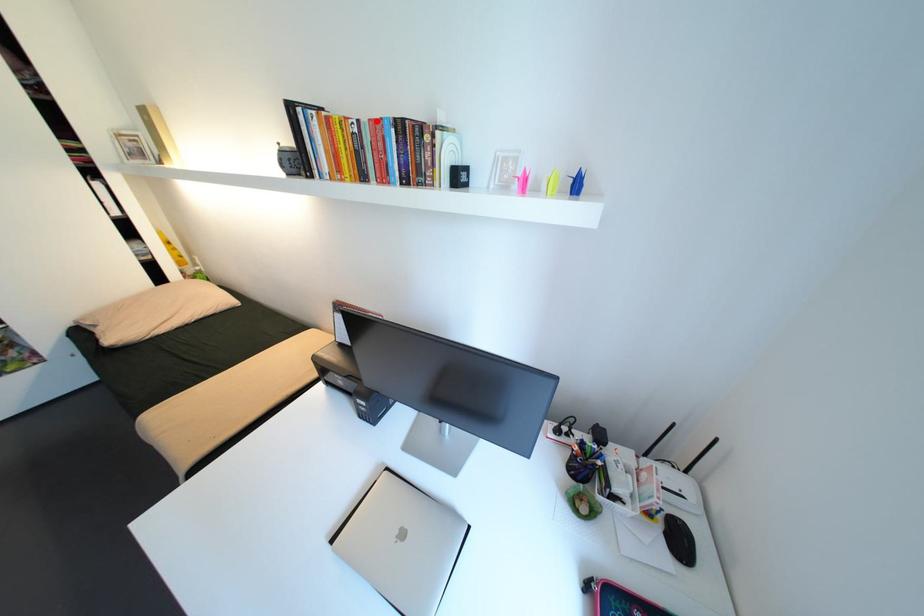
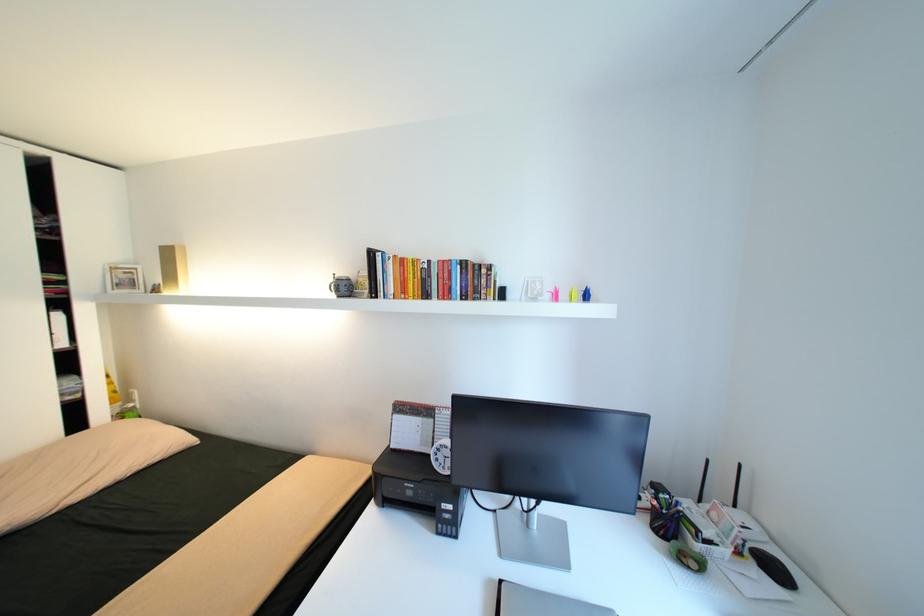
Where in the second image is the point corresponding to the highlighted location from the first image?

(445, 262)